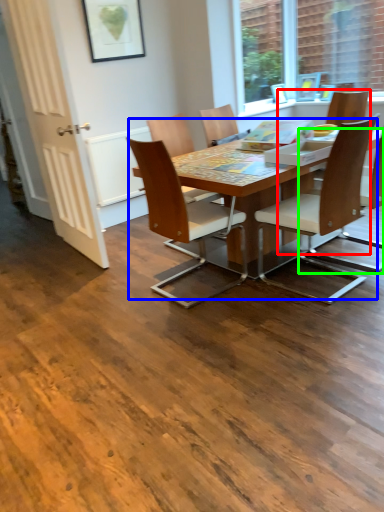
Question: Which object is the farthest from chair (highlighted by a red box)? Choose among these: kitchen & dining room table (highlighted by a blue box) or chair (highlighted by a green box).

Choices:
 (A) kitchen & dining room table
 (B) chair

Answer: (A)